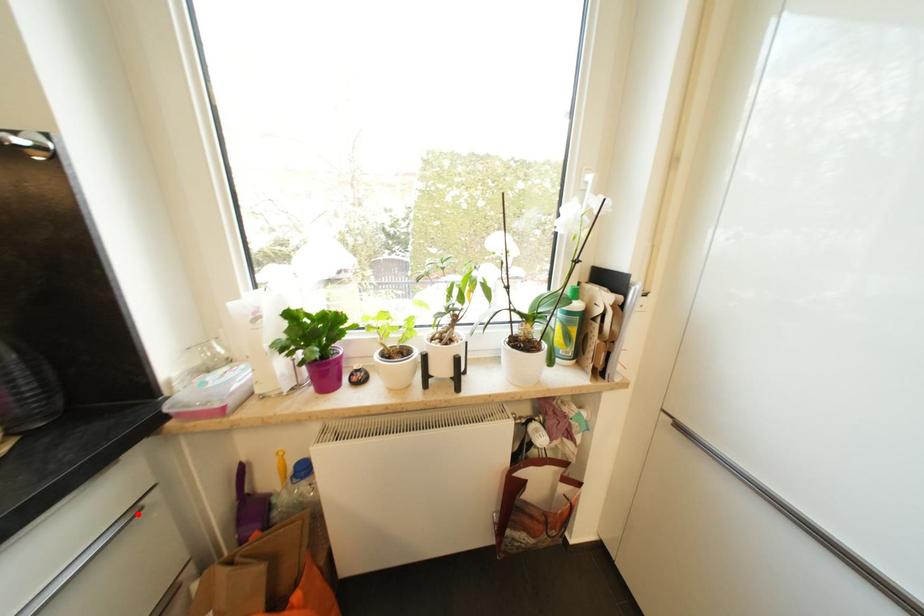
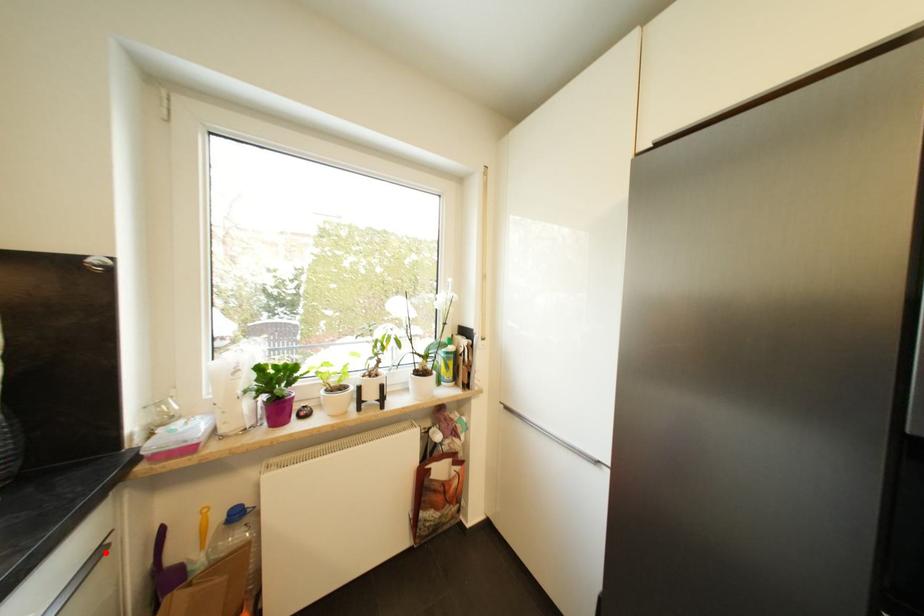
I am providing you with two images of the same scene from different viewpoints. A red point is marked on the first image and another point is marked on the second image. Are the points marked in image1 and image2 representing the same 3D position?

Yes